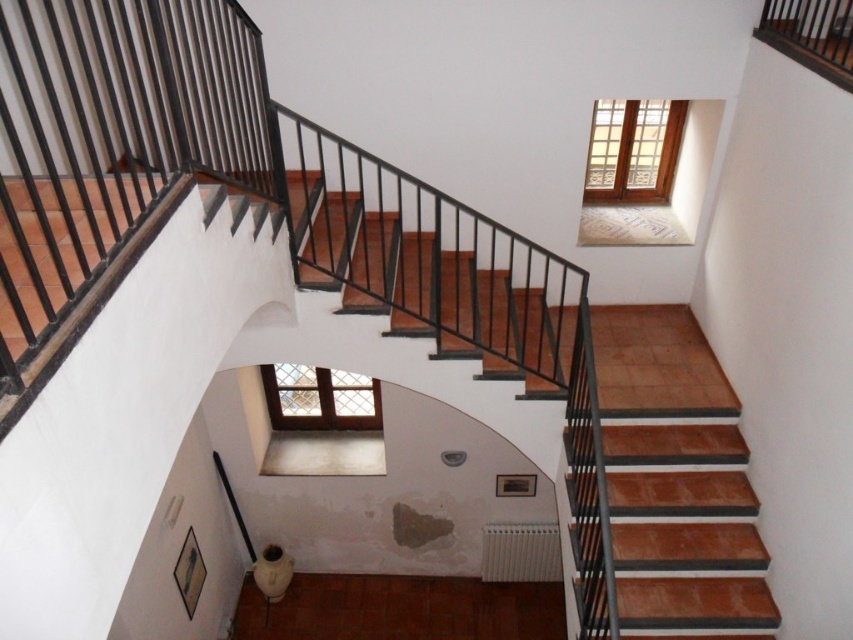
How far apart are clear glass window at upper right and clear glass window at center?

clear glass window at upper right and clear glass window at center are 8.76 feet apart from each other.

The width and height of the screenshot is (853, 640). Describe the element at coordinates (631, 150) in the screenshot. I see `clear glass window at upper right` at that location.

The image size is (853, 640). What are the coordinates of `clear glass window at upper right` in the screenshot? It's located at (631, 150).